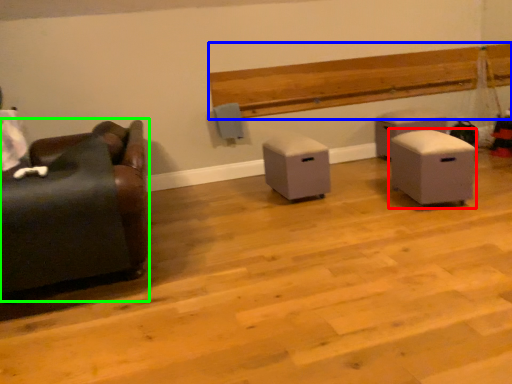
Question: Which object is positioned farthest from furniture (highlighted by a red box)? Select from hardwood (highlighted by a blue box) and furniture (highlighted by a green box).

Choices:
 (A) hardwood
 (B) furniture

Answer: (B)